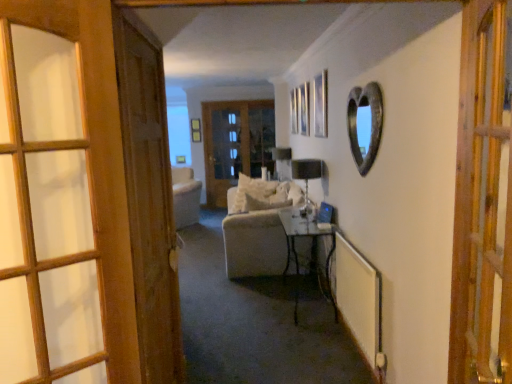
This screenshot has height=384, width=512. What do you see at coordinates (321, 105) in the screenshot?
I see `metallic silver picture frame at upper center, which is the first picture frame from bottom to top` at bounding box center [321, 105].

The width and height of the screenshot is (512, 384). What do you see at coordinates (236, 144) in the screenshot? I see `wooden glass door at center, arranged as the first door when viewed from the back` at bounding box center [236, 144].

Measure the distance between point (328, 231) and camera.

They are 3.75 meters apart.

Where is `metallic silver picture frame at upper center, acting as the 2th picture frame starting from the top`? The width and height of the screenshot is (512, 384). metallic silver picture frame at upper center, acting as the 2th picture frame starting from the top is located at coordinates (321, 105).

From the image's perspective, is wooden door at left, positioned as the first door in left-to-right order, on metallic silver table at center?

Yes, from the image's perspective, wooden door at left, positioned as the first door in left-to-right order, is above metallic silver table at center.

How many degrees apart are the facing directions of wooden door at left, placed as the third door when sorted from back to front, and metallic silver table at center?

The angular difference between wooden door at left, placed as the third door when sorted from back to front, and metallic silver table at center is 130 degrees.

Which is more to the left, wooden door at left, which is counted as the 4th door, starting from the right, or metallic silver table at center?

Positioned to the left is wooden door at left, which is counted as the 4th door, starting from the right.

Is wooden door at left, placed as the third door when sorted from back to front, positioned far away from metallic silver table at center?

Indeed, wooden door at left, placed as the third door when sorted from back to front, is not near metallic silver table at center.

Which is closer, (309, 177) or (376, 111)?

Point (309, 177).

Which object is wider, metallic glass lamp at center, the second lamp from the back, or rustic metal heart-shaped mirror at upper right?

With larger width is metallic glass lamp at center, the second lamp from the back.

Looking at this image, is metallic glass lamp at center, the second lamp from the back, taller than rustic metal heart-shaped mirror at upper right?

Incorrect, the height of metallic glass lamp at center, the second lamp from the back, is not larger of that of rustic metal heart-shaped mirror at upper right.

Between point (194, 141) and point (362, 171), which one is positioned behind?

Positioned behind is point (194, 141).

Is matte wooden picture frame at upper center, the second picture frame in the right-to-left sequence, not near rustic metal heart-shaped mirror at upper right?

Yes, matte wooden picture frame at upper center, the second picture frame in the right-to-left sequence, and rustic metal heart-shaped mirror at upper right are quite far apart.

Is matte wooden picture frame at upper center, the second picture frame in the right-to-left sequence, further to the viewer compared to rustic metal heart-shaped mirror at upper right?

Yes, it is behind rustic metal heart-shaped mirror at upper right.

Between matte wooden picture frame at upper center, which is counted as the 1th picture frame, starting from the back, and rustic metal heart-shaped mirror at upper right, which one has smaller width?

matte wooden picture frame at upper center, which is counted as the 1th picture frame, starting from the back.

Considering the positions of objects wooden door at left, the second door in the front-to-back sequence, and matte wooden picture frame at upper center, which ranks as the 2th picture frame in front-to-back order, in the image provided, who is more to the right, wooden door at left, the second door in the front-to-back sequence, or matte wooden picture frame at upper center, which ranks as the 2th picture frame in front-to-back order,?

From the viewer's perspective, wooden door at left, the second door in the front-to-back sequence, appears more on the right side.

Between wooden door at left, the second door in the front-to-back sequence, and matte wooden picture frame at upper center, which is counted as the 1th picture frame, starting from the back, which one has more height?

wooden door at left, the second door in the front-to-back sequence, is taller.

Is wooden door at left, positioned as the first door in left-to-right order, wider or thinner than matte wooden picture frame at upper center, acting as the first picture frame starting from the top?

In the image, wooden door at left, positioned as the first door in left-to-right order, appears to be wider than matte wooden picture frame at upper center, acting as the first picture frame starting from the top.

Locate an element on the screen. The height and width of the screenshot is (384, 512). the 3rd door in front of the matte wooden picture frame at upper center, which ranks as the 2th picture frame in front-to-back order is located at coordinates (99, 164).

Is metallic glass lamp at center, marked as the first lamp in a front-to-back arrangement, spatially inside transparent glass door at center, or outside of it?

metallic glass lamp at center, marked as the first lamp in a front-to-back arrangement, is located beyond the bounds of transparent glass door at center.

Considering the positions of objects metallic glass lamp at center, the second lamp from the back, and transparent glass door at center in the image provided, who is more to the left, metallic glass lamp at center, the second lamp from the back, or transparent glass door at center?

Positioned to the left is transparent glass door at center.

Which is behind, metallic glass lamp at center, the second lamp from the back, or transparent glass door at center?

transparent glass door at center is behind.

Considering the points (309, 175) and (218, 182), which point is in front, point (309, 175) or point (218, 182)?

The point (309, 175) is closer.

Between point (314, 125) and point (508, 289), which one is positioned behind?

The point (314, 125) is farther from the camera.

In terms of height, does metallic silver picture frame at upper center, the first picture frame from the right, look taller or shorter compared to wooden door at right, which ranks as the 4th door in back-to-front order?

Considering their sizes, metallic silver picture frame at upper center, the first picture frame from the right, has less height than wooden door at right, which ranks as the 4th door in back-to-front order.

From a real-world perspective, between metallic silver picture frame at upper center, the first picture frame from the right, and wooden door at right, marked as the fourth door in a left-to-right arrangement, who is vertically higher?

metallic silver picture frame at upper center, the first picture frame from the right, from a real-world perspective.

From the image's perspective, would you say wooden door at left, which is counted as the 4th door, starting from the right, is positioned over transparent glass door at center?

Incorrect, from the image's perspective, wooden door at left, which is counted as the 4th door, starting from the right, is lower than transparent glass door at center.

In the scene shown: Does wooden door at left, placed as the third door when sorted from back to front, have a lesser width compared to transparent glass door at center?

Incorrect, the width of wooden door at left, placed as the third door when sorted from back to front, is not less than that of transparent glass door at center.

Is transparent glass door at center at the back of wooden door at left, which is counted as the 4th door, starting from the right?

No, wooden door at left, which is counted as the 4th door, starting from the right, is not facing away from transparent glass door at center.

Who is bigger, wooden door at left, which is counted as the 4th door, starting from the right, or transparent glass door at center?

transparent glass door at center is bigger.

Find the location of `door that is the 3rd one when counting leftward from the metallic silver table at center`. door that is the 3rd one when counting leftward from the metallic silver table at center is located at coordinates (99, 164).

What are the coordinates of `lamp below the rustic metal heart-shaped mirror at upper right (from the image's perspective)` in the screenshot? It's located at (306, 173).

From the image, which object appears to be nearer to transparent glass door at center, wooden door at right, marked as the fourth door in a left-to-right arrangement, or metallic silver picture frame at upper center, which is the 2th picture frame in back-to-front order?

The object closer to transparent glass door at center is metallic silver picture frame at upper center, which is the 2th picture frame in back-to-front order.

Estimate the real-world distances between objects in this image. Which object is closer to wooden door at left, positioned as the first door in left-to-right order, metallic glass lamp at center, the second lamp from the back, or matte black lampshade at center, placed as the second lamp when sorted from front to back?

metallic glass lamp at center, the second lamp from the back.

Estimate the real-world distances between objects in this image. Which object is closer to metallic silver table at center, transparent glass door at center or white soft pillow at center?

Among the two, white soft pillow at center is located nearer to metallic silver table at center.

Based on the photo, from the image, which object appears to be farther from matte black lampshade at center, placed as the second lamp when sorted from front to back, wooden glass door at center, the 4th door positioned from the front, or rustic metal heart-shaped mirror at upper right?

rustic metal heart-shaped mirror at upper right is positioned further to the anchor matte black lampshade at center, placed as the second lamp when sorted from front to back.

Considering their positions, is transparent glass door at center positioned further to metallic silver table at center than wooden door at left, positioned as the first door in left-to-right order?

Based on the image, transparent glass door at center appears to be further to metallic silver table at center.

From the image, which object appears to be farther from transparent glass door at center, matte wooden picture frame at upper center, which ranks as the 2th picture frame in front-to-back order, or metallic glass lamp at center, marked as the first lamp in a front-to-back arrangement?

The object further to transparent glass door at center is metallic glass lamp at center, marked as the first lamp in a front-to-back arrangement.

Looking at the image, which one is located further to metallic silver table at center, transparent glass door at center or matte black lampshade at center, which ranks as the first lamp in back-to-front order?

transparent glass door at center is positioned further to the anchor metallic silver table at center.

When comparing their distances from matte wooden picture frame at upper center, which ranks as the 2th picture frame in front-to-back order, does metallic silver picture frame at upper center, which is the 2th picture frame in back-to-front order, or wooden glass door at center, the 3th door when ordered from left to right, seem closer?

wooden glass door at center, the 3th door when ordered from left to right, is closer to matte wooden picture frame at upper center, which ranks as the 2th picture frame in front-to-back order.

The image size is (512, 384). Find the location of `door located between metallic glass lamp at center, the second lamp from the back, and matte wooden picture frame at upper center, the second picture frame when ordered from bottom to top, in the depth direction`. door located between metallic glass lamp at center, the second lamp from the back, and matte wooden picture frame at upper center, the second picture frame when ordered from bottom to top, in the depth direction is located at coordinates (236, 144).

Find the location of a particular element. Image resolution: width=512 pixels, height=384 pixels. picture frame between wooden door at left, placed as the third door when sorted from back to front, and transparent glass door at center from front to back is located at coordinates (321, 105).

Locate an element on the screen. lamp between white soft pillow at center and wooden glass door at center, arranged as the first door when viewed from the back, in the front-back direction is located at coordinates (282, 162).

Locate an element on the screen. The height and width of the screenshot is (384, 512). door located between wooden door at left, acting as the second door starting from the left, and matte wooden picture frame at upper center, marked as the first picture frame in a left-to-right arrangement, in the depth direction is located at coordinates pyautogui.click(x=236, y=144).